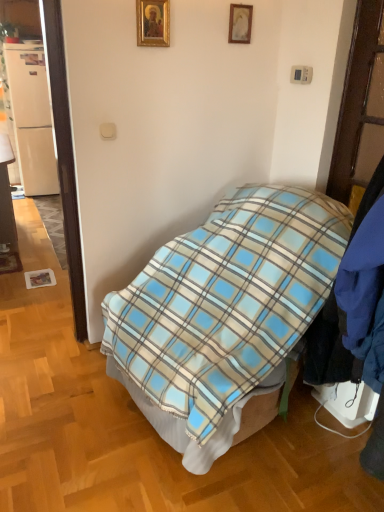
Question: Is the depth of blue plaid blanket at center greater than that of matte wood desk at left?

Choices:
 (A) no
 (B) yes

Answer: (A)

Question: Is blue plaid blanket at center positioned far away from matte wood desk at left?

Choices:
 (A) no
 (B) yes

Answer: (B)

Question: Does blue plaid blanket at center have a greater width compared to matte wood desk at left?

Choices:
 (A) no
 (B) yes

Answer: (B)

Question: Could you tell me if blue plaid blanket at center is facing matte wood desk at left?

Choices:
 (A) no
 (B) yes

Answer: (A)

Question: From the image's perspective, is blue plaid blanket at center above matte wood desk at left?

Choices:
 (A) yes
 (B) no

Answer: (B)

Question: Is white glossy door at left bigger or smaller than wooden picture frame at upper center, the 2th picture frame positioned from the left?

Choices:
 (A) big
 (B) small

Answer: (A)

Question: In the image, is white glossy door at left positioned in front of or behind wooden picture frame at upper center, placed as the 1th picture frame when sorted from back to front?

Choices:
 (A) behind
 (B) front

Answer: (B)

Question: Looking at their shapes, would you say white glossy door at left is wider or thinner than wooden picture frame at upper center, placed as the 1th picture frame when sorted from back to front?

Choices:
 (A) wide
 (B) thin

Answer: (A)

Question: From their relative heights in the image, would you say white glossy door at left is taller or shorter than wooden picture frame at upper center, marked as the 2th picture frame in a front-to-back arrangement?

Choices:
 (A) tall
 (B) short

Answer: (A)

Question: Considering the positions of white glossy door at left and blue plaid blanket at center in the image, is white glossy door at left bigger or smaller than blue plaid blanket at center?

Choices:
 (A) big
 (B) small

Answer: (B)

Question: From their relative heights in the image, would you say white glossy door at left is taller or shorter than blue plaid blanket at center?

Choices:
 (A) tall
 (B) short

Answer: (A)

Question: Do you think white glossy door at left is within blue plaid blanket at center, or outside of it?

Choices:
 (A) inside
 (B) outside

Answer: (B)

Question: Looking at their shapes, would you say white glossy door at left is wider or thinner than blue plaid blanket at center?

Choices:
 (A) thin
 (B) wide

Answer: (A)

Question: In terms of height, does white glossy door at left look taller or shorter compared to gold-framed picture at upper center, acting as the 2th picture frame starting from the back?

Choices:
 (A) short
 (B) tall

Answer: (B)

Question: Would you say white glossy door at left is to the left or to the right of gold-framed picture at upper center, the 2th picture frame in the right-to-left sequence, in the picture?

Choices:
 (A) right
 (B) left

Answer: (B)